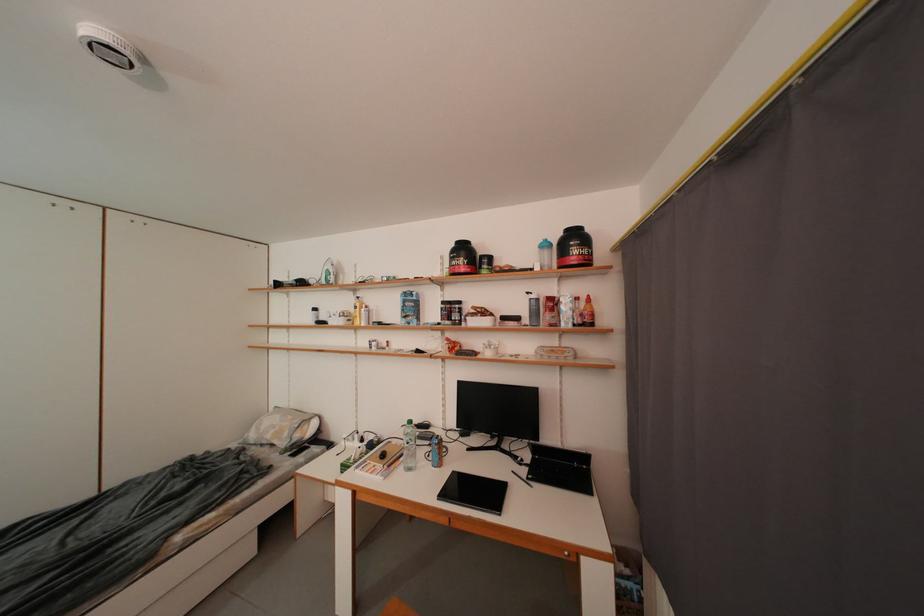
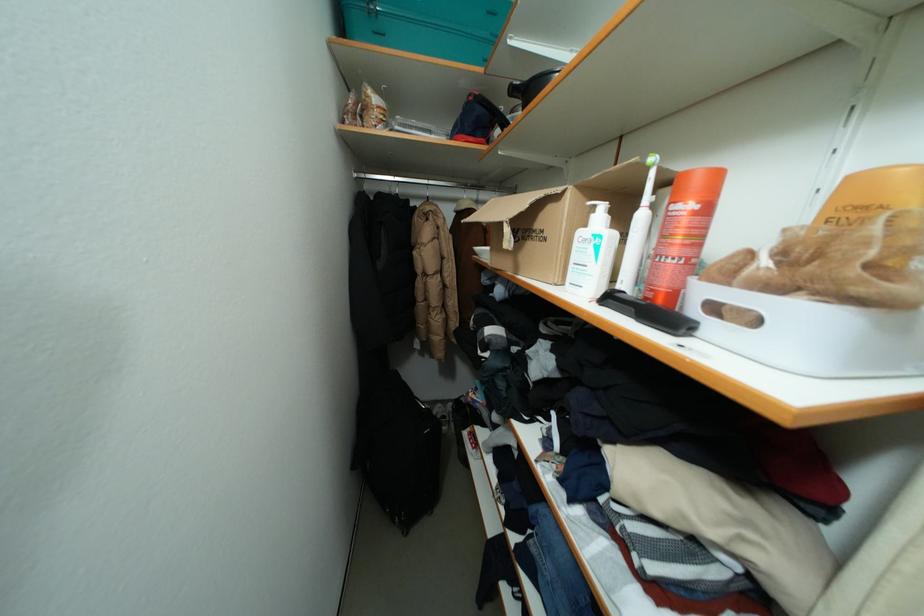
Question: I am providing you with two images of the same scene from different viewpoints. Please identify which objects are invisible in image2.

Choices:
 (A) hanger hook
 (B) white spiral notebook
 (C) white bottle pump
 (D) yellow watering can

Answer: (B)